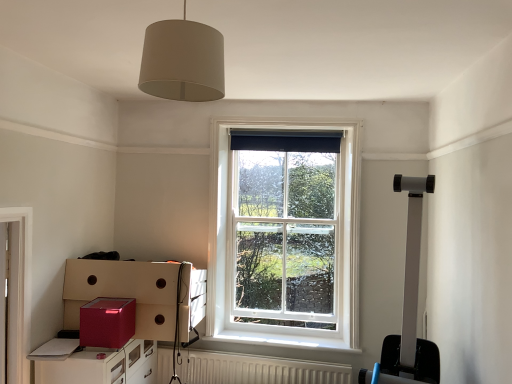
Question: From their relative heights in the image, would you say shiny red cardboard box at lower left, marked as the second cardboard box in a back-to-front arrangement, is taller or shorter than black fabric curtain at upper center?

Choices:
 (A) short
 (B) tall

Answer: (B)

Question: Would you say shiny red cardboard box at lower left, marked as the second cardboard box in a back-to-front arrangement, is to the left or to the right of black fabric curtain at upper center in the picture?

Choices:
 (A) right
 (B) left

Answer: (B)

Question: Which of these objects is positioned farthest from the white wooden window at center?

Choices:
 (A) shiny red cabinet at lower left
 (B) matte red cardboard box at lower left, the first cardboard box when ordered from back to front
 (C) shiny red cardboard box at lower left, marked as the second cardboard box in a back-to-front arrangement
 (D) white textured radiator at lower center
 (E) matte white lampshade at upper center

Answer: (E)

Question: Which is farther from the matte white lampshade at upper center?

Choices:
 (A) matte red cardboard box at lower left, the first cardboard box when ordered from back to front
 (B) shiny red cabinet at lower left
 (C) black fabric curtain at upper center
 (D) white textured radiator at lower center
 (E) shiny red cardboard box at lower left, marked as the second cardboard box in a back-to-front arrangement

Answer: (D)